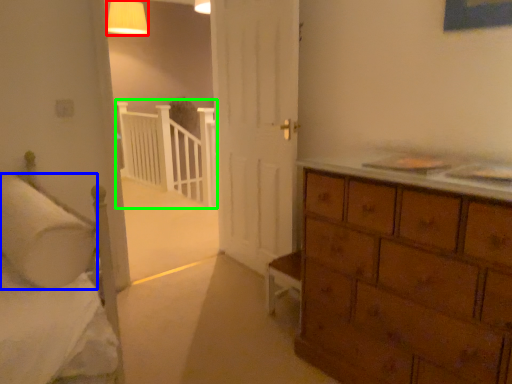
Question: Which object is positioned closest to lighting (highlighted by a red box)? Select from pillow (highlighted by a blue box) and balustrade (highlighted by a green box).

Choices:
 (A) pillow
 (B) balustrade

Answer: (B)